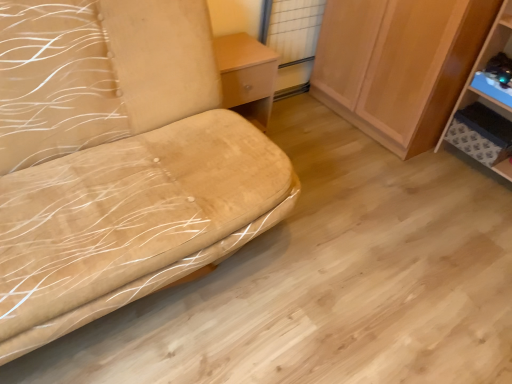
Find the location of a particular element. This screenshot has height=384, width=512. free spot in front of blue plastic shelf at right is located at coordinates (476, 206).